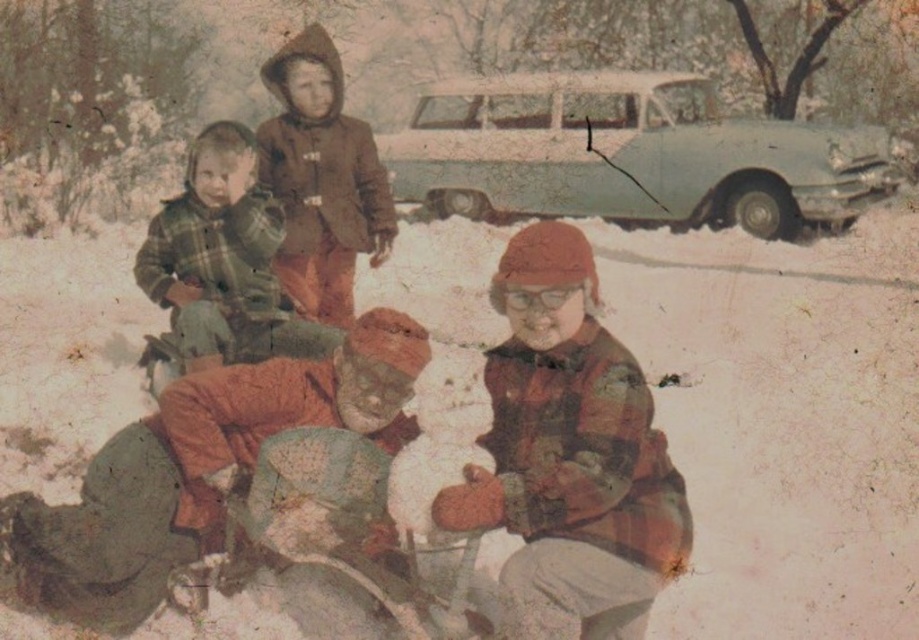
Question: Which of the following is the closest to the observer?

Choices:
 (A) (485, 353)
 (B) (803, 221)
 (C) (8, 522)
 (D) (166, 256)

Answer: (A)

Question: Is the position of plaid flannel shirt at center less distant than that of green plaid shirt at left?

Choices:
 (A) yes
 (B) no

Answer: (A)

Question: Which is nearer to the light blue metallic car at upper center?

Choices:
 (A) green plaid shirt at left
 (B) plaid flannel shirt at center
 (C) flannel shirt at center

Answer: (A)

Question: Among these points, which one is nearest to the camera?

Choices:
 (A) coord(394,141)
 (B) coord(282,460)
 (C) coord(235,282)

Answer: (B)

Question: Is flannel shirt at center above light blue metallic car at upper center?

Choices:
 (A) yes
 (B) no

Answer: (B)

Question: Can you confirm if plaid flannel shirt at center is smaller than green plaid shirt at left?

Choices:
 (A) yes
 (B) no

Answer: (A)